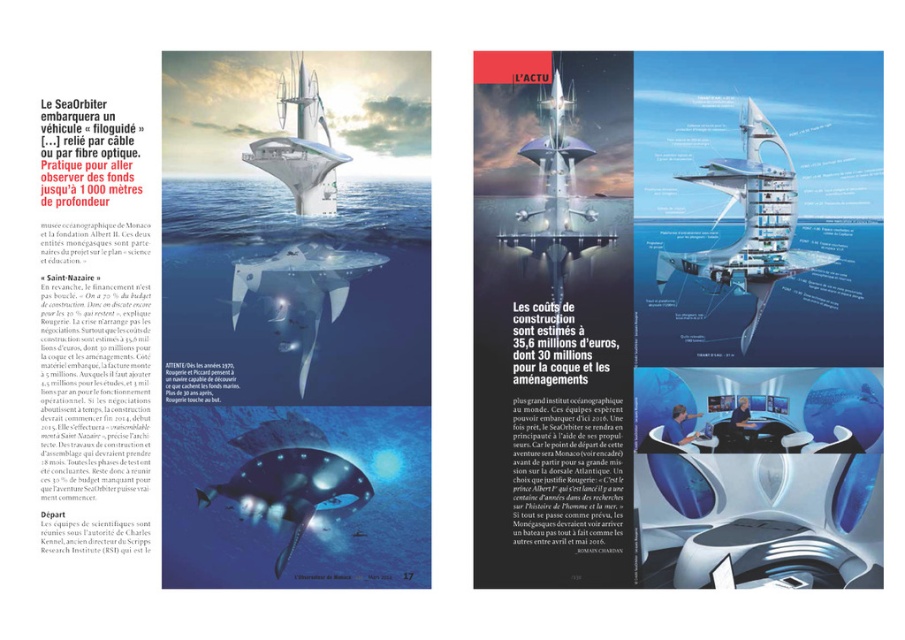
Is translucent glass pod at center to the left of shiny blue glass skyscraper at upper center from the viewer's perspective?

In fact, translucent glass pod at center is to the right of shiny blue glass skyscraper at upper center.

Locate an element on the screen. The width and height of the screenshot is (905, 640). translucent glass pod at center is located at coordinates (758, 520).

Based on the photo, does white glossy submarine at center have a lesser height compared to shiny blue glass skyscraper at upper center?

No.

Between white glossy submarine at center and shiny blue glass skyscraper at upper center, which one has less height?

With less height is shiny blue glass skyscraper at upper center.

Where is `white glossy submarine at center`? white glossy submarine at center is located at coordinates (294, 320).

Which is more to the right, white glossy submarine at center or translucent glass pod at center?

translucent glass pod at center

Is white glossy submarine at center closer to camera compared to translucent glass pod at center?

No, it is not.

Who is more distant from viewer, (248, 182) or (713, 486)?

The point (248, 182) is behind.

The image size is (905, 640). Find the location of `white glossy submarine at center`. white glossy submarine at center is located at coordinates (294, 320).